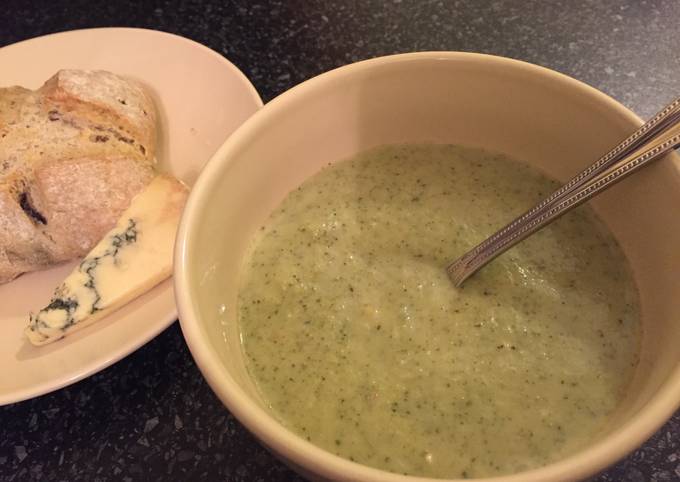
You are a GUI agent. You are given a task and a screenshot of the screen. Output one action in this format:
    pyautogui.click(x=<x>, y=<y>)
    Task: Click on the gray speckled kitchen counter top
    The height and width of the screenshot is (482, 680).
    Given the screenshot: What is the action you would take?
    pyautogui.click(x=160, y=437), pyautogui.click(x=282, y=41), pyautogui.click(x=663, y=467)